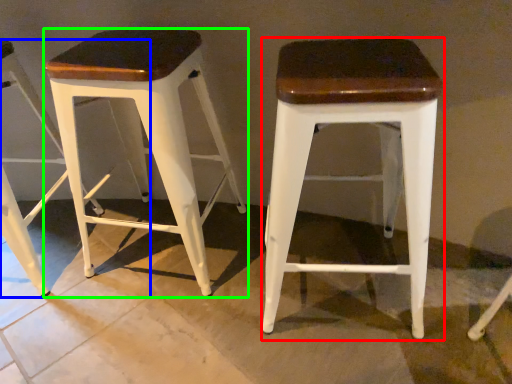
Question: Based on their relative distances, which object is farther from stool (highlighted by a red box)? Choose from stool (highlighted by a blue box) and stool (highlighted by a green box).

Choices:
 (A) stool
 (B) stool

Answer: (A)